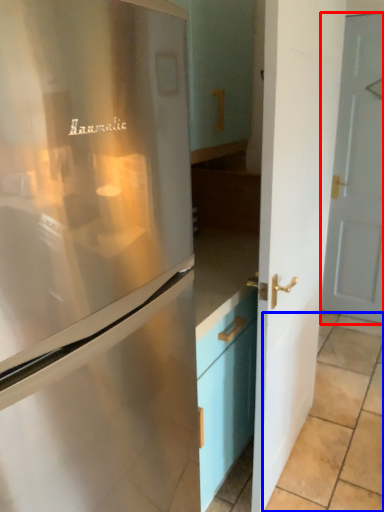
Question: Which point is further to the camera, door (highlighted by a red box) or tile (highlighted by a blue box)?

Choices:
 (A) door
 (B) tile

Answer: (A)